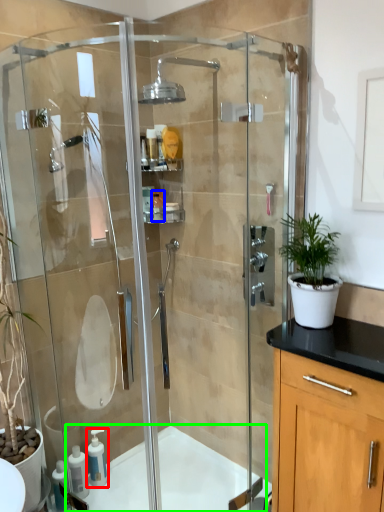
Question: Which is farther away from soap dispenser (highlighted by a red box)? toiletry (highlighted by a blue box) or bath (highlighted by a green box)?

Choices:
 (A) toiletry
 (B) bath

Answer: (A)